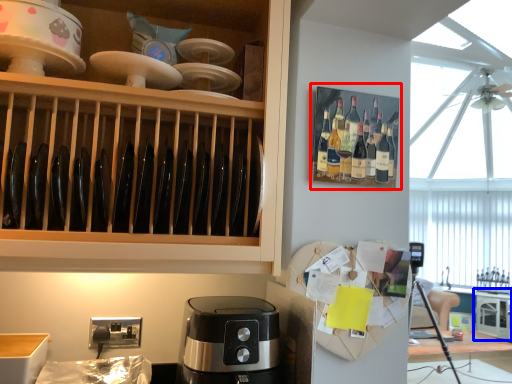
Question: Which of the following is the closest to the observer, shelf (highlighted by a red box) or cabinetry (highlighted by a blue box)?

Choices:
 (A) shelf
 (B) cabinetry

Answer: (A)